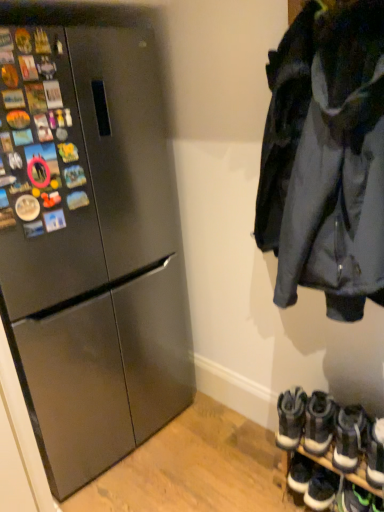
Image resolution: width=384 pixels, height=512 pixels. Identify the location of white suede sneakers at lower right, which is counted as the fifth footwear, starting from the right. (321, 489).

This screenshot has width=384, height=512. What are the coordinates of `white suede sneakers at lower right, the seventh footwear viewed from the right` in the screenshot? It's located at (291, 418).

Which object is wider, dark gray fabric jacket at upper right or satin black refrigerator at left?

Wider between the two is satin black refrigerator at left.

Consider the image. Is dark gray fabric jacket at upper right not inside satin black refrigerator at left?

dark gray fabric jacket at upper right lies outside satin black refrigerator at left's area.

Does point (327, 13) appear closer or farther from the camera than point (123, 249)?

Point (327, 13).

Who is shorter, dark gray fabric jacket at upper right or white suede sneakers at lower right, the 1th footwear positioned from the left?

white suede sneakers at lower right, the 1th footwear positioned from the left.

Does point (281, 298) come closer to viewer compared to point (281, 443)?

Yes, point (281, 298) is in front of point (281, 443).

From the image's perspective, would you say dark gray fabric jacket at upper right is shown under white suede sneakers at lower right, the 1th footwear positioned from the left?

No.

Is dark gray fabric jacket at upper right closer to camera compared to white suede sneakers at lower right, the seventh footwear viewed from the right?

Yes, dark gray fabric jacket at upper right is in front of white suede sneakers at lower right, the seventh footwear viewed from the right.

Is satin black refrigerator at left at the right side of dark gray fabric jacket at upper right?

No, satin black refrigerator at left is not to the right of dark gray fabric jacket at upper right.

Is satin black refrigerator at left oriented away from dark gray fabric jacket at upper right?

No, satin black refrigerator at left is not facing away from dark gray fabric jacket at upper right.

From the image's perspective, is satin black refrigerator at left above dark gray fabric jacket at upper right?

No, from the image's perspective, satin black refrigerator at left is not on top of dark gray fabric jacket at upper right.

Considering the relative sizes of satin black refrigerator at left and dark gray fabric jacket at upper right in the image provided, is satin black refrigerator at left thinner than dark gray fabric jacket at upper right?

In fact, satin black refrigerator at left might be wider than dark gray fabric jacket at upper right.

Which is closer to the camera, (371,442) or (324,409)?

Point (371,442) is positioned farther from the camera compared to point (324,409).

Is white suede sneakers at lower right, which is the first footwear in right-to-left order, oriented towards white leather sneakers at lower right, the 2th footwear from the left?

No, white suede sneakers at lower right, which is the first footwear in right-to-left order, is not facing towards white leather sneakers at lower right, the 2th footwear from the left.

Would you say white suede sneakers at lower right, positioned as the seventh footwear in left-to-right order, is a long distance from white leather sneakers at lower right, the sixth footwear positioned from the right?

They are positioned close to each other.

Looking at this image, does white suede sneakers at lower right, positioned as the seventh footwear in left-to-right order, have a lesser width compared to white leather sneakers at lower right, the sixth footwear positioned from the right?

In fact, white suede sneakers at lower right, positioned as the seventh footwear in left-to-right order, might be wider than white leather sneakers at lower right, the sixth footwear positioned from the right.

Can you confirm if white rubber sneakers at lower right, which is counted as the 3th footwear, starting from the right, is smaller than white suede sneakers at lower right, which is the first footwear in right-to-left order?

No.

How much distance is there between white rubber sneakers at lower right, which is counted as the 3th footwear, starting from the right, and white suede sneakers at lower right, positioned as the seventh footwear in left-to-right order?

white rubber sneakers at lower right, which is counted as the 3th footwear, starting from the right, is 5.30 inches from white suede sneakers at lower right, positioned as the seventh footwear in left-to-right order.

Would you say white rubber sneakers at lower right, which is the fifth footwear from left to right, is a long distance from white suede sneakers at lower right, which is the first footwear in right-to-left order?

No, white rubber sneakers at lower right, which is the fifth footwear from left to right, is not far away from white suede sneakers at lower right, which is the first footwear in right-to-left order.

Considering their positions, is white rubber sneakers at lower right, which is counted as the 3th footwear, starting from the right, located in front of or behind white suede sneakers at lower right, positioned as the seventh footwear in left-to-right order?

Visually, white rubber sneakers at lower right, which is counted as the 3th footwear, starting from the right, is located behind white suede sneakers at lower right, positioned as the seventh footwear in left-to-right order.

From the image's perspective, is dark gray fabric jacket at upper right located above or below white suede sneakers at lower right, positioned as the seventh footwear in left-to-right order?

From the image's perspective, dark gray fabric jacket at upper right appears above white suede sneakers at lower right, positioned as the seventh footwear in left-to-right order.

The height and width of the screenshot is (512, 384). In order to click on jacket that is on the left side of white suede sneakers at lower right, which is the first footwear in right-to-left order in this screenshot , I will do `click(326, 157)`.

Is point (361, 86) in front of point (379, 431)?

Yes, point (361, 86) is in front of point (379, 431).

Is dark gray fabric jacket at upper right behind white suede sneakers at lower right, which is the first footwear in right-to-left order?

No, it is not.

Between white synthetic sneakers at lower right, the fourth footwear positioned from the right, and dark gray fabric jacket at upper right, which one has less height?

With less height is white synthetic sneakers at lower right, the fourth footwear positioned from the right.

Is dark gray fabric jacket at upper right at the back of white synthetic sneakers at lower right, which is the fourth footwear in left-to-right order?

No, white synthetic sneakers at lower right, which is the fourth footwear in left-to-right order, is not facing away from dark gray fabric jacket at upper right.

From the image's perspective, is white synthetic sneakers at lower right, the fourth footwear positioned from the right, above or below dark gray fabric jacket at upper right?

From the image's perspective, white synthetic sneakers at lower right, the fourth footwear positioned from the right, appears below dark gray fabric jacket at upper right.

Identify the location of jacket on the right of the satin black refrigerator at left. (326, 157).

At what (x,y) coordinates should I click in order to perform the action: click on the 6th footwear behind the dark gray fabric jacket at upper right, starting your count from the anchor. Please return your answer as a coordinate pair (x, y). This screenshot has width=384, height=512. Looking at the image, I should click on (291, 418).

From the image, which object appears to be farther from white leather sneakers at lower right, the sixth footwear positioned from the right, white suede sneakers at lower right, which is counted as the fifth footwear, starting from the right, or green suede sneakers at lower right, placed as the sixth footwear when sorted from left to right?

Based on the image, green suede sneakers at lower right, placed as the sixth footwear when sorted from left to right, appears to be further to white leather sneakers at lower right, the sixth footwear positioned from the right.

Considering their positions, is white suede sneakers at lower right, acting as the third footwear starting from the left, positioned closer to white suede sneakers at lower right, which is the first footwear in right-to-left order, than white leather sneakers at lower right, the sixth footwear positioned from the right?

white leather sneakers at lower right, the sixth footwear positioned from the right, lies closer to white suede sneakers at lower right, which is the first footwear in right-to-left order, than the other object.

When comparing their distances from white rubber sneakers at lower right, which is counted as the 3th footwear, starting from the right, does white suede sneakers at lower right, positioned as the seventh footwear in left-to-right order, or satin black refrigerator at left seem closer?

The object closer to white rubber sneakers at lower right, which is counted as the 3th footwear, starting from the right, is white suede sneakers at lower right, positioned as the seventh footwear in left-to-right order.

Based on their spatial positions, is green suede sneakers at lower right, placed as the sixth footwear when sorted from left to right, or white suede sneakers at lower right, acting as the third footwear starting from the left, closer to dark gray fabric jacket at upper right?

Based on the image, white suede sneakers at lower right, acting as the third footwear starting from the left, appears to be nearer to dark gray fabric jacket at upper right.

When comparing their distances from white suede sneakers at lower right, acting as the third footwear starting from the left, does dark gray fabric jacket at upper right or white suede sneakers at lower right, the seventh footwear viewed from the right, seem closer?

white suede sneakers at lower right, the seventh footwear viewed from the right, is positioned closer to the anchor white suede sneakers at lower right, acting as the third footwear starting from the left.

Which object lies further to the anchor point satin black refrigerator at left, green suede sneakers at lower right, placed as the sixth footwear when sorted from left to right, or white leather sneakers at lower right, the sixth footwear positioned from the right?

green suede sneakers at lower right, placed as the sixth footwear when sorted from left to right, lies further to satin black refrigerator at left than the other object.

Which object lies further to the anchor point white suede sneakers at lower right, acting as the third footwear starting from the left, white suede sneakers at lower right, the 1th footwear positioned from the left, or white leather sneakers at lower right, the sixth footwear positioned from the right?

white suede sneakers at lower right, the 1th footwear positioned from the left.

When comparing their distances from white rubber sneakers at lower right, which is counted as the 3th footwear, starting from the right, does white suede sneakers at lower right, the 1th footwear positioned from the left, or white suede sneakers at lower right, which is counted as the fifth footwear, starting from the right, seem closer?

white suede sneakers at lower right, the 1th footwear positioned from the left, is closer to white rubber sneakers at lower right, which is counted as the 3th footwear, starting from the right.

The width and height of the screenshot is (384, 512). What are the coordinates of `jacket situated between satin black refrigerator at left and white rubber sneakers at lower right, which is counted as the 3th footwear, starting from the right, from left to right` in the screenshot? It's located at (326, 157).

In order to click on footwear between white suede sneakers at lower right, positioned as the seventh footwear in left-to-right order, and white suede sneakers at lower right, which is counted as the fifth footwear, starting from the right, in the up-down direction in this screenshot , I will do `click(331, 452)`.

The image size is (384, 512). What are the coordinates of `jacket between satin black refrigerator at left and white leather sneakers at lower right, the 2th footwear from the left, in the horizontal direction` in the screenshot? It's located at (326, 157).

Find the location of a particular element. The image size is (384, 512). jacket located between satin black refrigerator at left and white suede sneakers at lower right, positioned as the seventh footwear in left-to-right order, in the left-right direction is located at coordinates (326, 157).